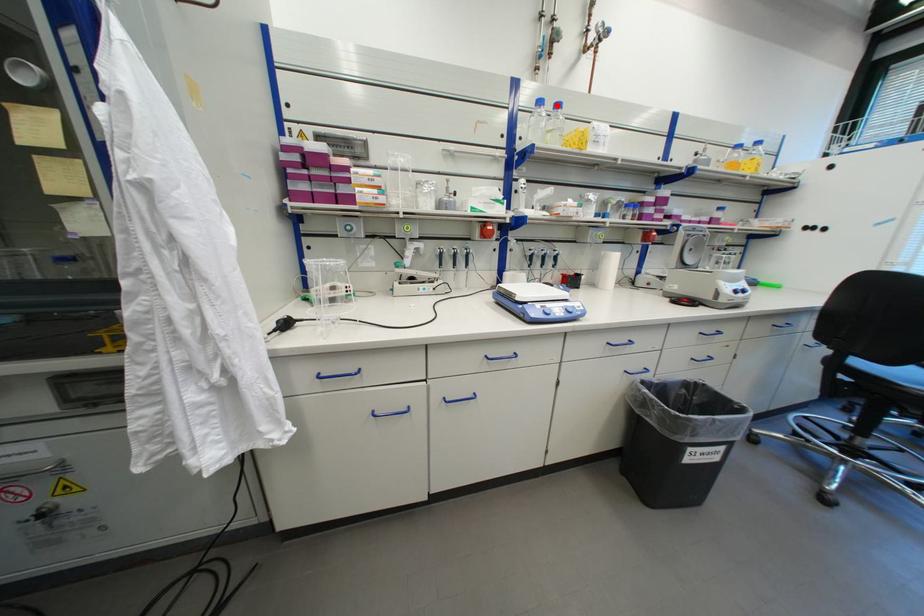
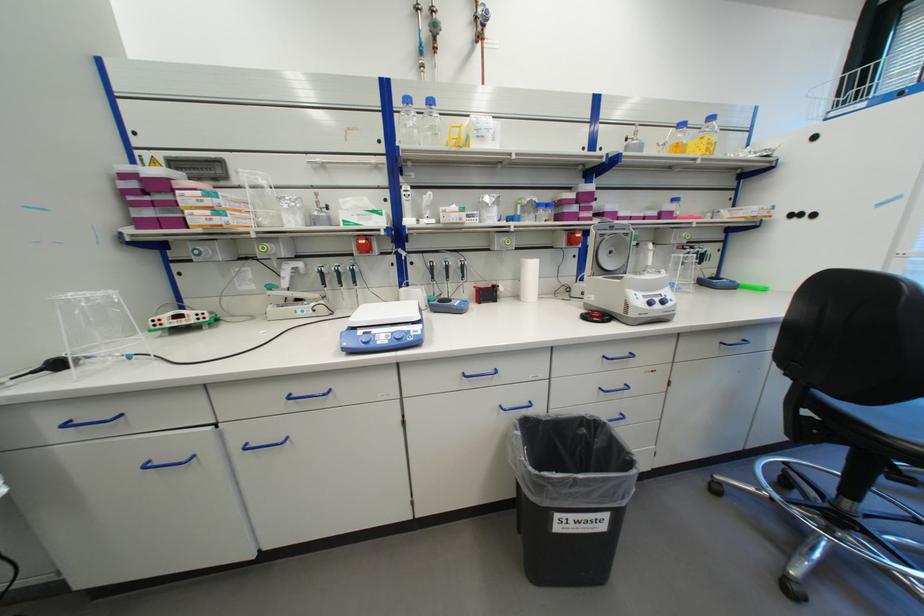
The point at the highlighted location is marked in the first image. Where is the corresponding point in the second image?

(428, 103)